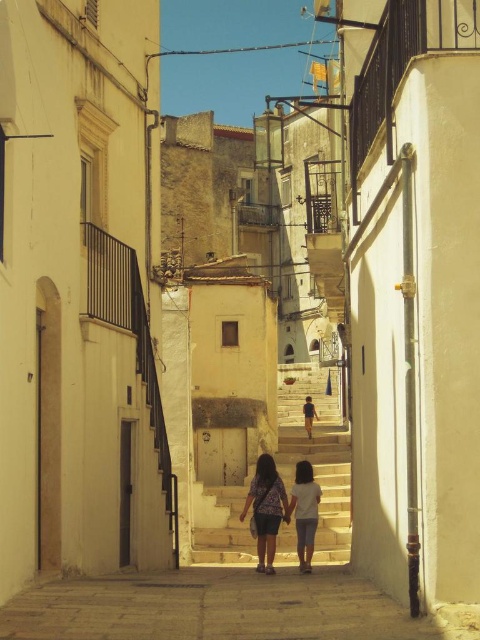
You are a traveler standing in the middle of the alleyway and see the light brown fabric dress at center and the light blue denim jeans at center hanging from a balcony. Which item is hanging higher up?

The light brown fabric dress at center is hanging higher up since it is much taller than the light blue denim jeans at center.

You are standing at the entrance of the alleyway and see the point marked at coordinates point (x=304, y=513). What object is located at that point?

The point (x=304, y=513) corresponds to light blue denim jeans at center.

You are a traveler carrying a backpack and want to pass through the narrow alleyway. You notice two items in the center of the path, a light blue denim jeans at center and a light blue denim shorts at center. Which item is narrower and might allow you to navigate around it more easily?

The light blue denim jeans at center has a lesser width compared to the light blue denim shorts at center, so it is narrower and might allow you to navigate around it more easily.